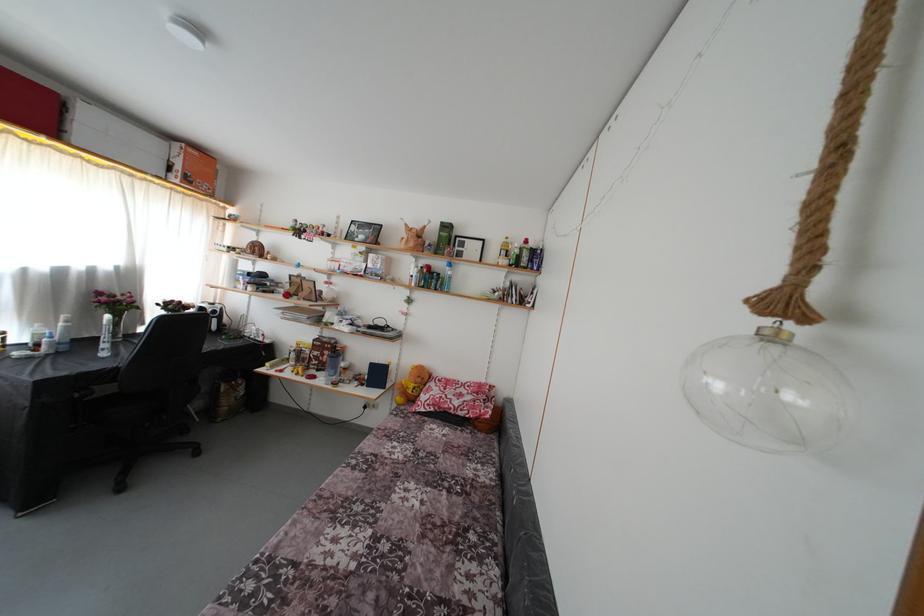
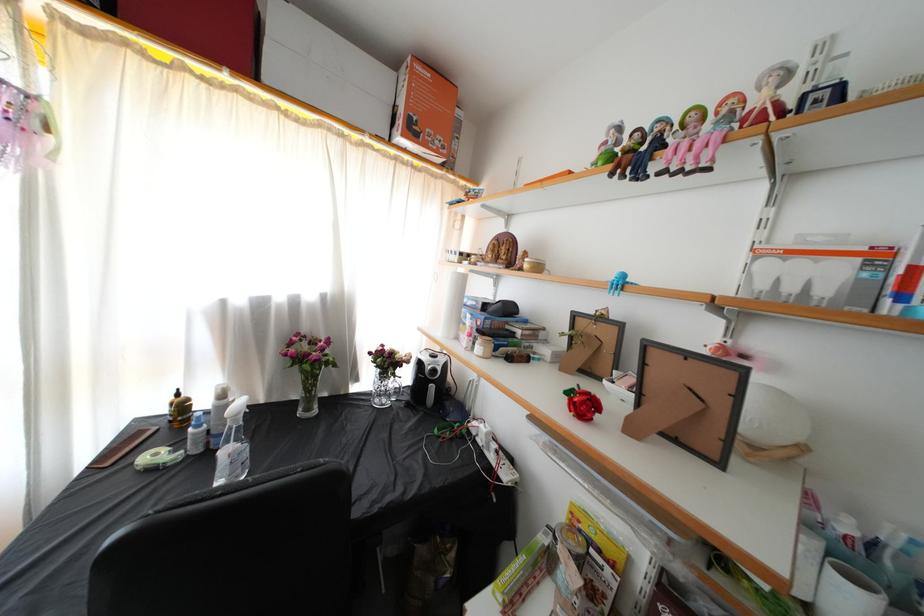
Where in the second image is the point corresponding to (309,243) from the first image?

(659, 172)